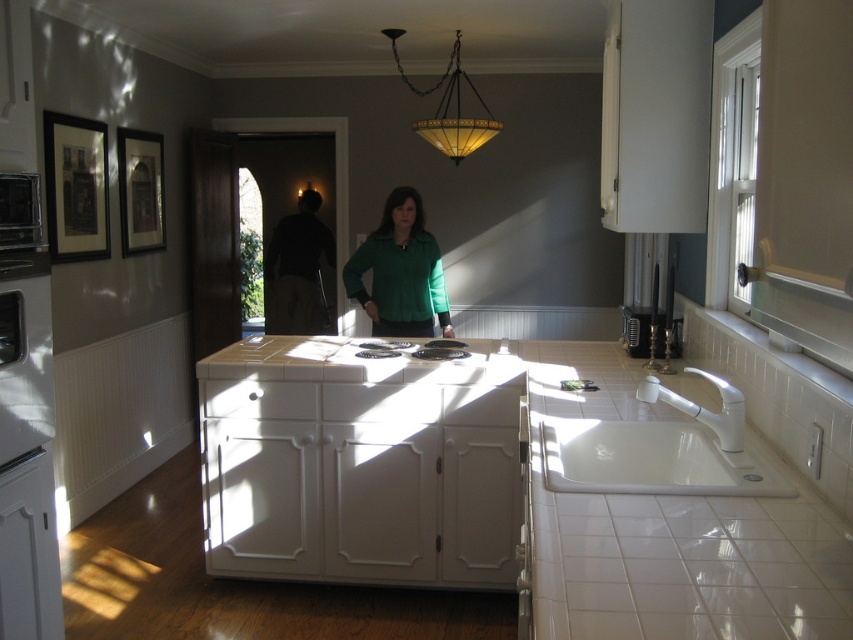
Question: Which point is farther to the camera?

Choices:
 (A) (495, 563)
 (B) (294, 304)
 (C) (397, 240)

Answer: (B)

Question: Which object appears closest to the camera in this image?

Choices:
 (A) white ceramic sink at lower right
 (B) green matte shirt at center

Answer: (A)

Question: Is white ceramic sink at lower right thinner than matte black shirt at center?

Choices:
 (A) yes
 (B) no

Answer: (A)

Question: Can you confirm if green matte shirt at center is positioned to the right of tinted glass chandelier at upper center?

Choices:
 (A) no
 (B) yes

Answer: (A)

Question: Does green matte shirt at center have a larger size compared to tinted glass chandelier at upper center?

Choices:
 (A) no
 (B) yes

Answer: (A)

Question: Which point is farther to the camera?

Choices:
 (A) white ceramic sink at lower right
 (B) green matte shirt at center
 (C) tinted glass chandelier at upper center

Answer: (C)